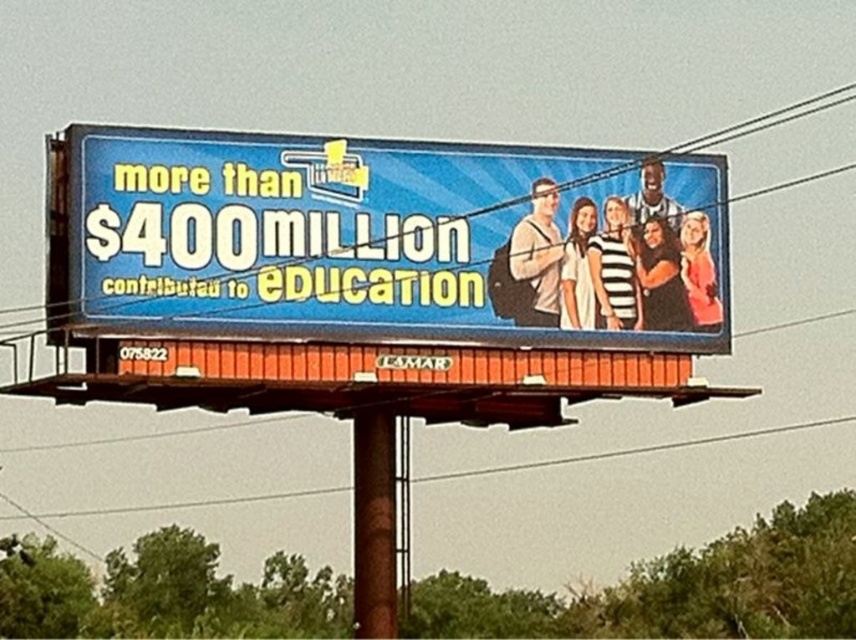
Question: In this image, where is blue plastic billboard at upper center located relative to brown wood pole at center?

Choices:
 (A) left
 (B) right

Answer: (B)

Question: Among these objects, which one is nearest to the camera?

Choices:
 (A) brown wood pole at center
 (B) blue plastic billboard at upper center

Answer: (B)

Question: Does blue plastic billboard at upper center come in front of brown wood pole at center?

Choices:
 (A) no
 (B) yes

Answer: (B)

Question: Which of the following is the closest to the observer?

Choices:
 (A) blue plastic billboard at upper center
 (B) brown wood pole at center

Answer: (A)

Question: Where is blue plastic billboard at upper center located in relation to brown wood pole at center in the image?

Choices:
 (A) right
 (B) left

Answer: (A)